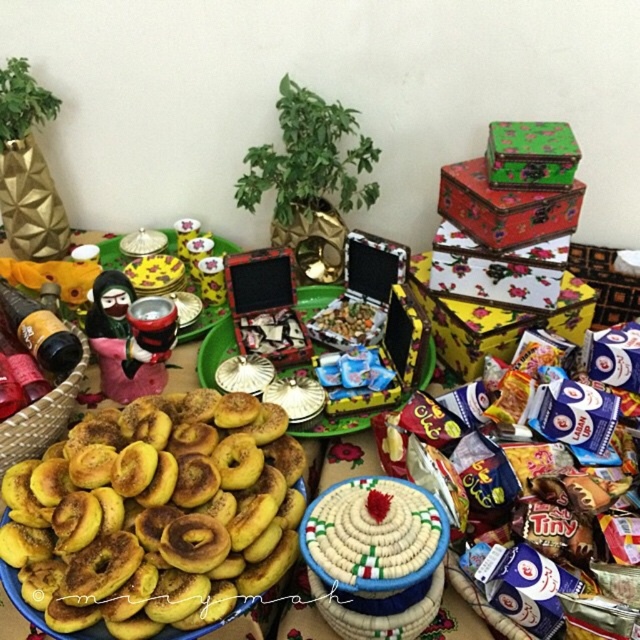
Question: Does yellow matte plate at center lie behind green painted wood box at upper right?

Choices:
 (A) no
 (B) yes

Answer: (A)

Question: Is golden brown doughnut at lower left bigger than green painted wood box at upper right?

Choices:
 (A) yes
 (B) no

Answer: (A)

Question: Does yellow matte plate at center have a lesser width compared to golden brown doughnut at lower left?

Choices:
 (A) no
 (B) yes

Answer: (A)

Question: Which point appears closest to the camera in this image?

Choices:
 (A) (323, 316)
 (B) (566, 160)

Answer: (B)

Question: Which point appears farthest from the camera in this image?

Choices:
 (A) (378, 330)
 (B) (209, 552)
 (C) (513, 134)
 (D) (289, 513)

Answer: (A)

Question: Which of the following is the closest to the observer?

Choices:
 (A) (241, 572)
 (B) (112, 380)
 (C) (336, 342)
 (D) (506, 132)

Answer: (A)